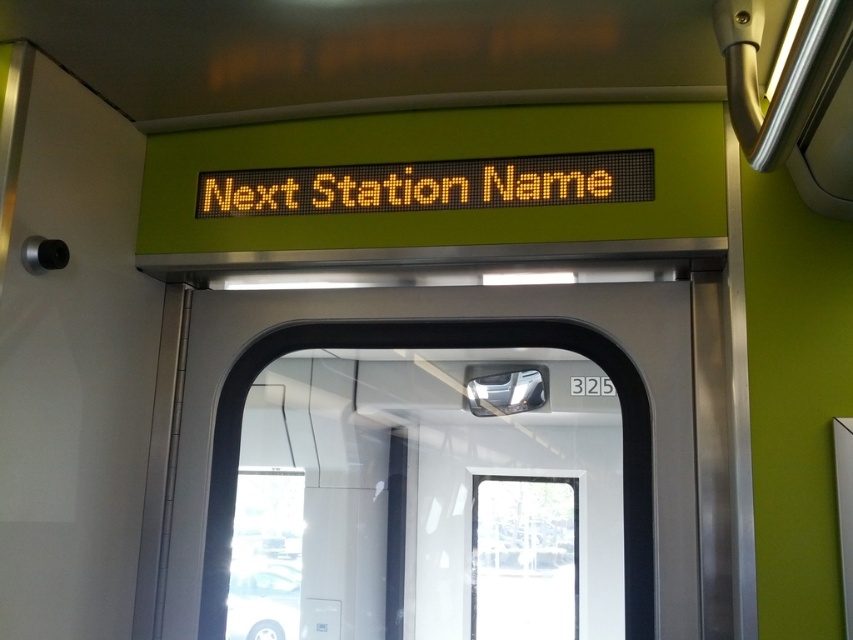
Question: Can you confirm if metallic silver door at center is smaller than yellow led display at upper center?

Choices:
 (A) yes
 (B) no

Answer: (B)

Question: Which object is farther from the camera taking this photo?

Choices:
 (A) yellow led display at upper center
 (B) metallic silver door at center

Answer: (A)

Question: Can you confirm if metallic silver door at center is positioned to the left of yellow led display at upper center?

Choices:
 (A) no
 (B) yes

Answer: (A)

Question: Is the position of metallic silver door at center more distant than that of yellow led display at upper center?

Choices:
 (A) yes
 (B) no

Answer: (B)